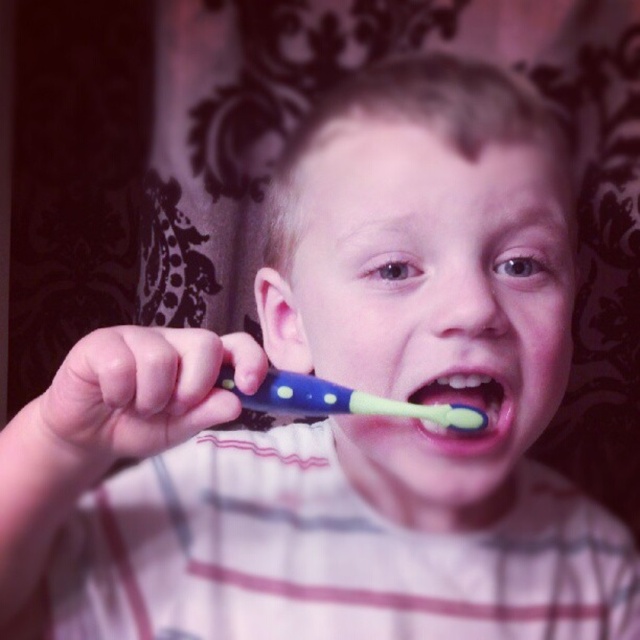
Based on the photo, can you confirm if blue rubber toothbrush at center is shorter than green rubber toothbrush at center?

No, blue rubber toothbrush at center is not shorter than green rubber toothbrush at center.

Is point (397, 412) less distant than point (490, 387)?

Yes, it is in front of point (490, 387).

Locate an element on the screen. This screenshot has height=640, width=640. blue rubber toothbrush at center is located at coordinates (340, 401).